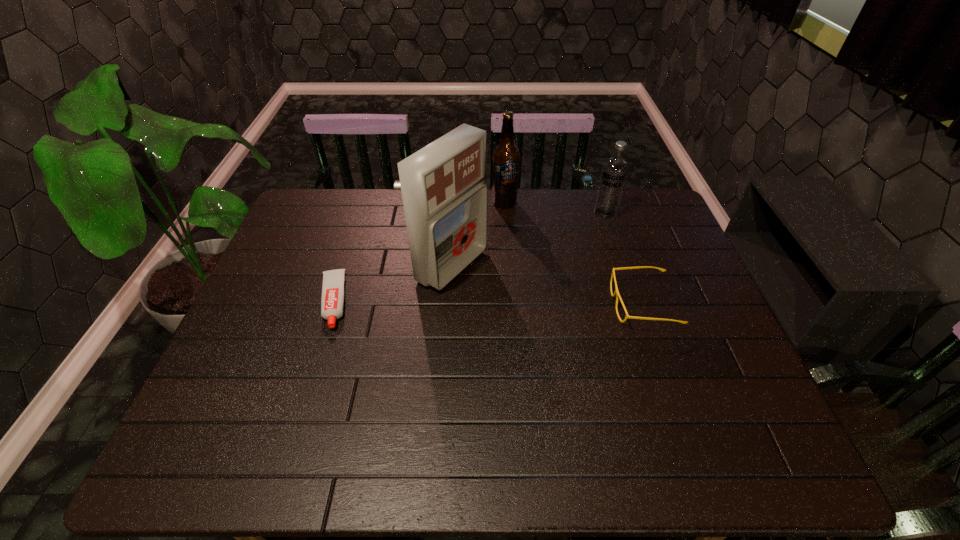
This screenshot has height=540, width=960. In order to click on free space at the far left corner in this screenshot , I will do `click(325, 217)`.

In order to click on vacant region at the far right corner of the desktop in this screenshot , I will do `click(641, 202)`.

Where is `vacant area that lies between the fourth tallest object and the vodka`? The image size is (960, 540). vacant area that lies between the fourth tallest object and the vodka is located at coordinates (624, 259).

You are a GUI agent. You are given a task and a screenshot of the screen. Output one action in this format:
    pyautogui.click(x=<x>, y=<y>)
    Task: Click on the free point between the spectacles and the tallest object
    Image resolution: width=960 pixels, height=540 pixels.
    Given the screenshot: What is the action you would take?
    pyautogui.click(x=547, y=285)

You are a GUI agent. You are given a task and a screenshot of the screen. Output one action in this format:
    pyautogui.click(x=<x>, y=<y>)
    Task: Click on the unoccupied position between the vodka and the beer bottle
    The height and width of the screenshot is (540, 960).
    Given the screenshot: What is the action you would take?
    pyautogui.click(x=555, y=208)

Locate an element on the screen. free spot between the vodka and the fourth shortest object is located at coordinates (555, 208).

I want to click on free space between the tallest object and the second shortest object, so click(547, 285).

Where is `empty location between the toothpaste and the first-aid kit`? The height and width of the screenshot is (540, 960). empty location between the toothpaste and the first-aid kit is located at coordinates coord(393,284).

Identify which object is the fourth nearest to the spectacles. Please provide its 2D coordinates. Your answer should be formatted as a tuple, i.e. [(x, y)], where the tuple contains the x and y coordinates of a point satisfying the conditions above.

[(332, 301)]

Identify which object is located as the nearest to the tallest object. Please provide its 2D coordinates. Your answer should be formatted as a tuple, i.e. [(x, y)], where the tuple contains the x and y coordinates of a point satisfying the conditions above.

[(506, 157)]